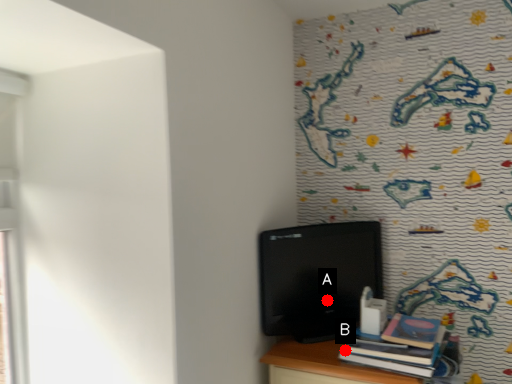
Question: Two points are circled on the image, labeled by A and B beside each circle. Which point is closer to the camera?

Choices:
 (A) A is closer
 (B) B is closer

Answer: (B)